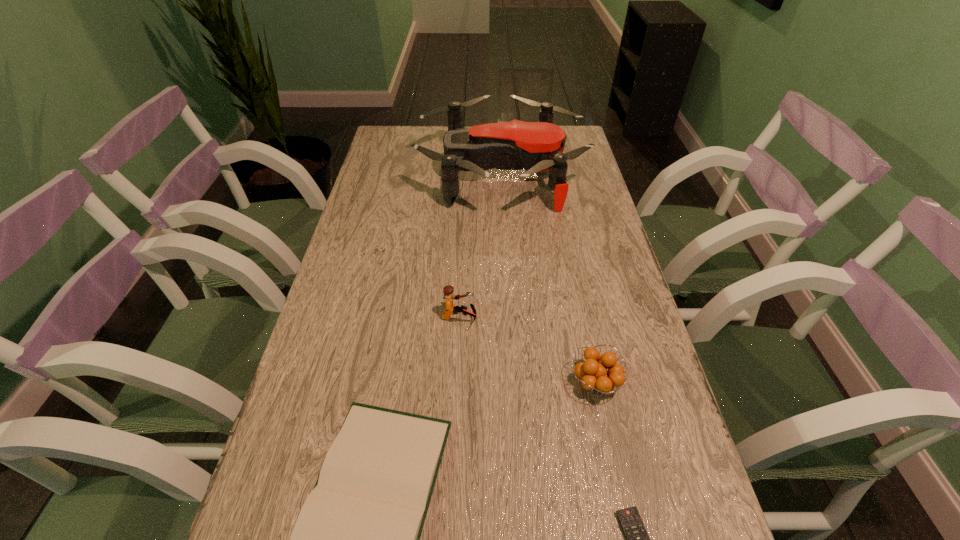
Where is `drone present at the right edge`? This screenshot has height=540, width=960. drone present at the right edge is located at coordinates (538, 146).

Locate an element on the screen. This screenshot has height=540, width=960. orange fruit that is at the right edge is located at coordinates (595, 377).

In order to click on object that is at the far right corner in this screenshot , I will do `click(538, 146)`.

I want to click on vacant position at the left edge of the desktop, so click(382, 228).

The image size is (960, 540). I want to click on vacant region at the right edge of the desktop, so [623, 339].

In the image, there is a desktop. Where is `free space at the far left corner`? free space at the far left corner is located at coordinates (417, 140).

In the image, there is a desktop. Where is `free space at the far right corner`? Image resolution: width=960 pixels, height=540 pixels. free space at the far right corner is located at coordinates (578, 129).

At what (x,y) coordinates should I click in order to perform the action: click on empty space between the drone and the fourth nearest object. Please return your answer as a coordinate pair (x, y). This screenshot has width=960, height=540. Looking at the image, I should click on (480, 246).

The image size is (960, 540). Identify the location of free spot between the second farthest object and the drone. (480, 246).

At what (x,y) coordinates should I click in order to perform the action: click on blank region between the second farthest object and the third tallest object. Please return your answer as a coordinate pair (x, y). The image size is (960, 540). Looking at the image, I should click on (527, 350).